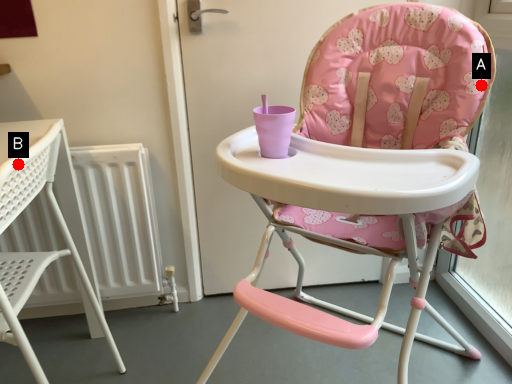
Question: Two points are circled on the image, labeled by A and B beside each circle. Which point appears farthest from the camera in this image?

Choices:
 (A) A is further
 (B) B is further

Answer: (A)